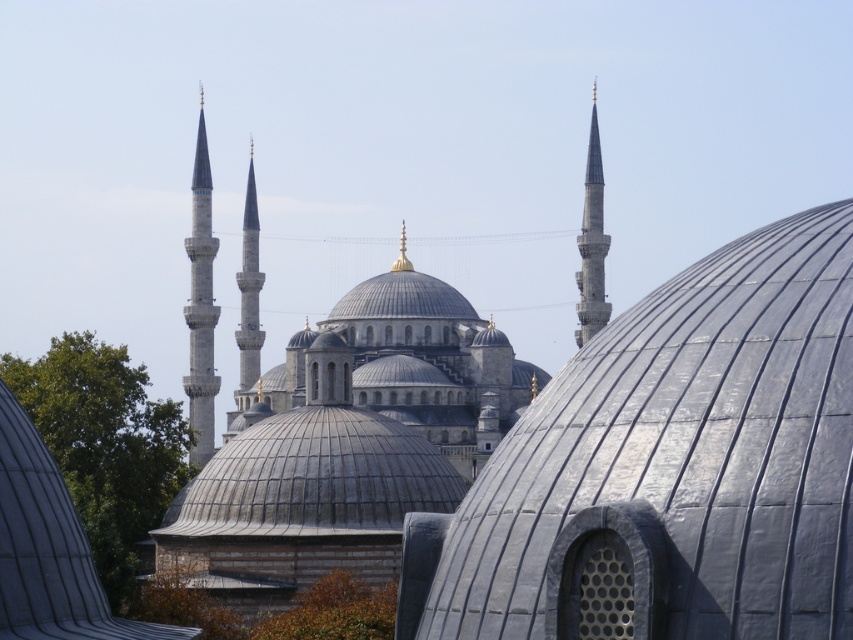
Consider the image. You are an architect examining the mosque structure. You notice the smooth silver spire at right and the slate gray stone minaret at center. Which of these two structures takes up more visual space in the image?

The slate gray stone minaret at center occupies more visual space than the smooth silver spire at right.

You are a drone operator tasked with capturing aerial footage of the mosque. Your drone has a maximum flight range of 25 meters. If you position yourself between the smooth white minaret at left and the smooth silver spire at right, can your drone safely fly from one to the other without exceeding its range?

The smooth white minaret at left is 22.49 meters away from the smooth silver spire at right. Since the drone has a maximum flight range of 25 meters, it can safely fly between them without exceeding its range.